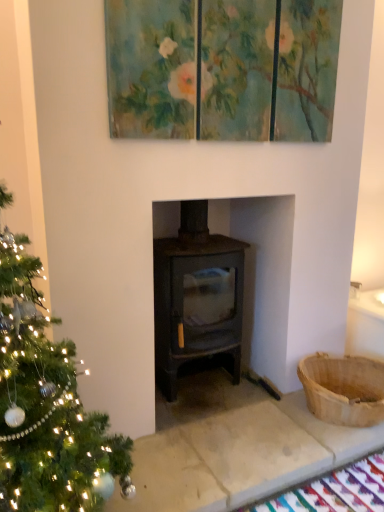
Question: Considering the relative sizes of teal textured triptych at upper center and brown woven basket at right in the image provided, is teal textured triptych at upper center wider than brown woven basket at right?

Choices:
 (A) no
 (B) yes

Answer: (A)

Question: Is teal textured triptych at upper center positioned behind brown woven basket at right?

Choices:
 (A) no
 (B) yes

Answer: (A)

Question: Does teal textured triptych at upper center have a lesser width compared to brown woven basket at right?

Choices:
 (A) no
 (B) yes

Answer: (B)

Question: Is teal textured triptych at upper center positioned before brown woven basket at right?

Choices:
 (A) yes
 (B) no

Answer: (A)

Question: Is teal textured triptych at upper center located outside brown woven basket at right?

Choices:
 (A) yes
 (B) no

Answer: (A)

Question: Is teal textured triptych at upper center at the left side of brown woven basket at right?

Choices:
 (A) no
 (B) yes

Answer: (B)

Question: From the image's perspective, does brown woven basket at right appear higher than matte black stove at center?

Choices:
 (A) no
 (B) yes

Answer: (A)

Question: Does brown woven basket at right come in front of matte black stove at center?

Choices:
 (A) yes
 (B) no

Answer: (B)

Question: Does brown woven basket at right come behind matte black stove at center?

Choices:
 (A) yes
 (B) no

Answer: (A)

Question: From the image's perspective, is brown woven basket at right under matte black stove at center?

Choices:
 (A) yes
 (B) no

Answer: (A)

Question: Does brown woven basket at right have a lesser width compared to matte black stove at center?

Choices:
 (A) yes
 (B) no

Answer: (A)

Question: From a real-world perspective, is brown woven basket at right beneath matte black stove at center?

Choices:
 (A) no
 (B) yes

Answer: (B)

Question: Are brown woven basket at right and teal textured triptych at upper center located far from each other?

Choices:
 (A) yes
 (B) no

Answer: (A)